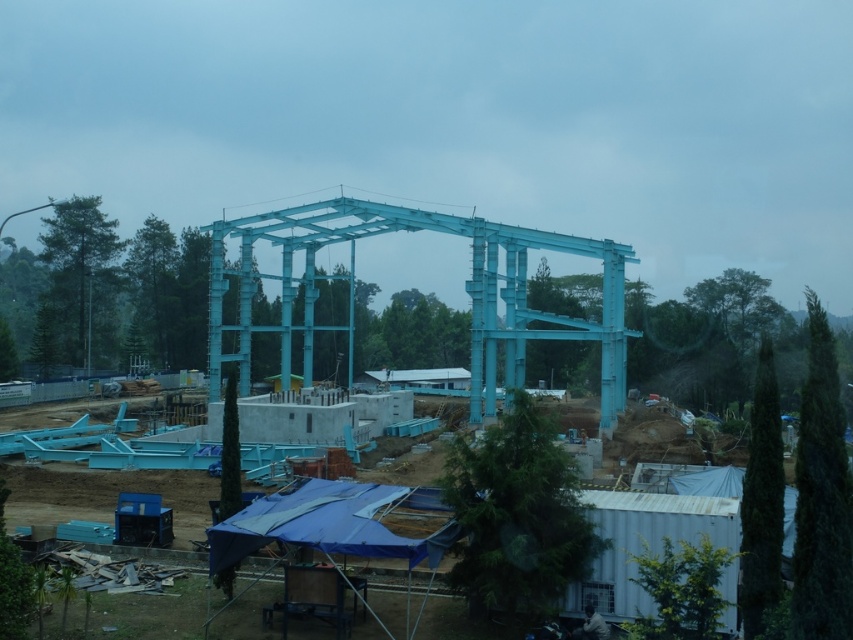
Is metallic blue steel structure at center below light blue metallic structure at center?

No.

Is metallic blue steel structure at center taller than light blue metallic structure at center?

Yes.

Describe the element at coordinates (465, 291) in the screenshot. I see `metallic blue steel structure at center` at that location.

The width and height of the screenshot is (853, 640). In order to click on metallic blue steel structure at center in this screenshot , I will do `click(465, 291)`.